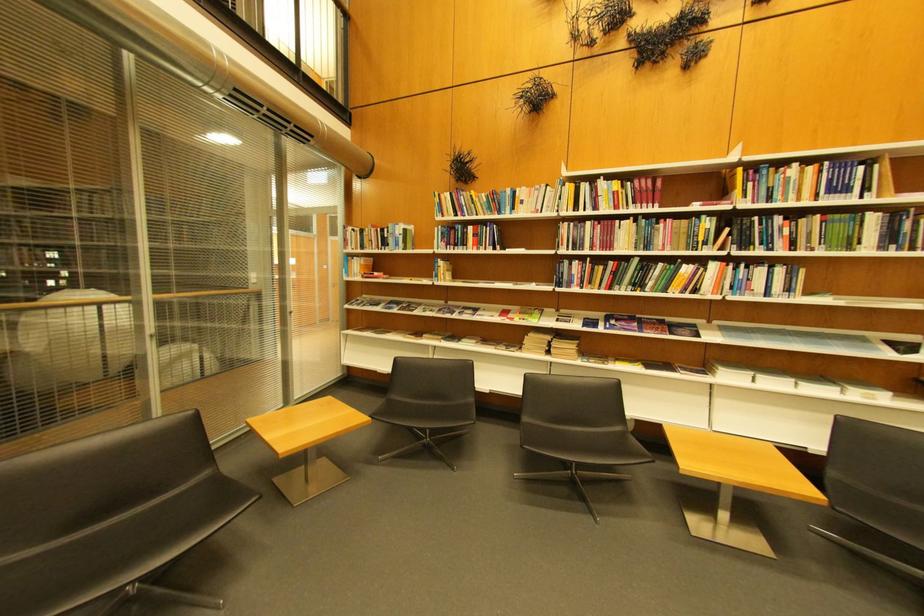
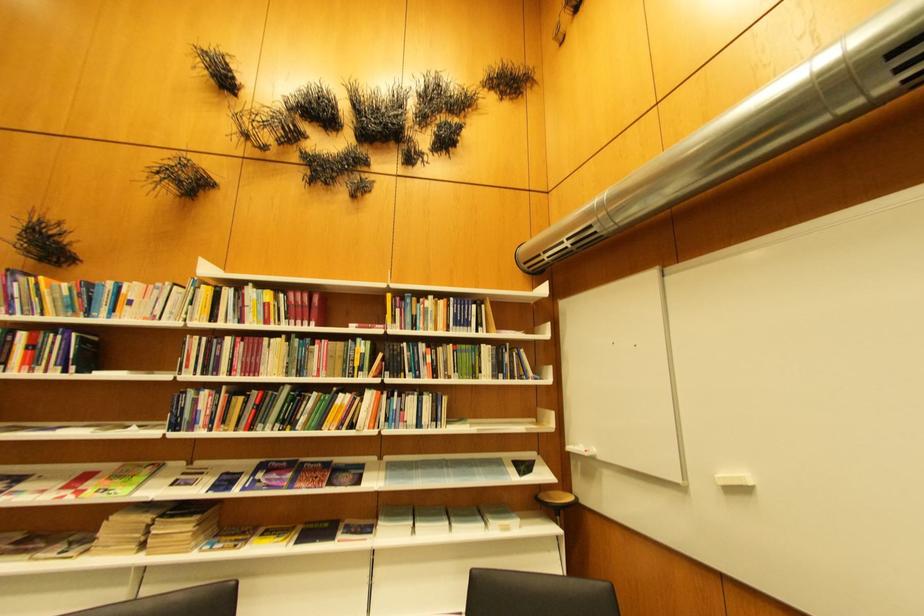
The point at (807, 386) is marked in the first image. Where is the corresponding point in the second image?

(460, 527)